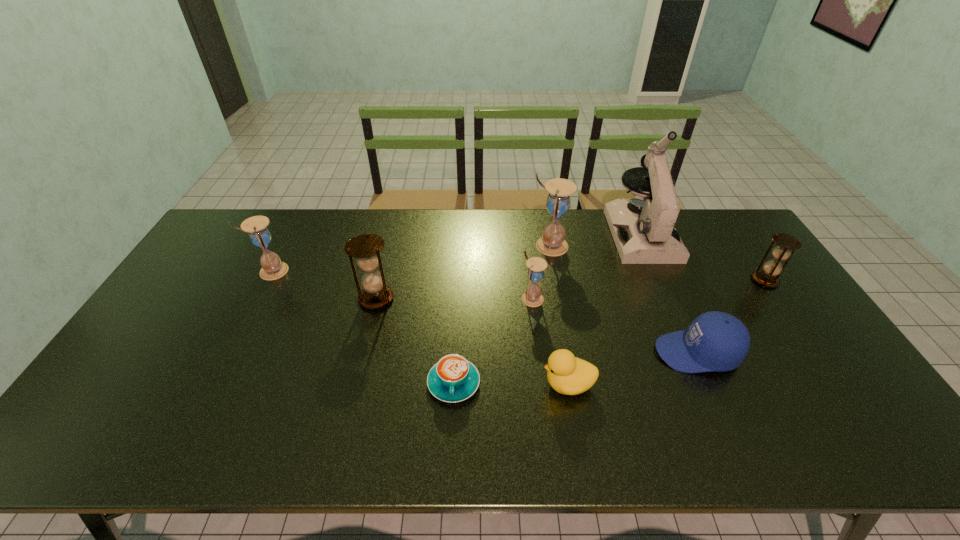
Where is `vacant space located on the front-facing side of the cap`? This screenshot has width=960, height=540. vacant space located on the front-facing side of the cap is located at coordinates (552, 353).

You are a GUI agent. You are given a task and a screenshot of the screen. Output one action in this format:
    pyautogui.click(x=<x>, y=<y>)
    Task: Click on the free space located 0.080m on the front-facing side of the cap
    The width and height of the screenshot is (960, 540).
    Given the screenshot: What is the action you would take?
    pyautogui.click(x=626, y=353)

The height and width of the screenshot is (540, 960). In order to click on vacant space situated 0.380m on the front-facing side of the cap in this screenshot , I will do `click(515, 353)`.

Identify the location of vacant space situated on the front-facing side of the duck. (416, 384).

Locate an element on the screen. Image resolution: width=960 pixels, height=540 pixels. free region located 0.180m on the front-facing side of the duck is located at coordinates (471, 384).

Where is `vacant space located 0.140m on the front-facing side of the duck`? vacant space located 0.140m on the front-facing side of the duck is located at coordinates (487, 384).

This screenshot has height=540, width=960. In order to click on free spot located with the handle on the right side of the third object from left to right in this screenshot , I will do `click(451, 437)`.

Locate an element on the screen. The height and width of the screenshot is (540, 960). microscope that is at the far edge is located at coordinates point(643,229).

The image size is (960, 540). I want to click on hourglass situated at the far edge, so click(x=552, y=243).

Where is `object present at the right edge`? The image size is (960, 540). object present at the right edge is located at coordinates (768, 277).